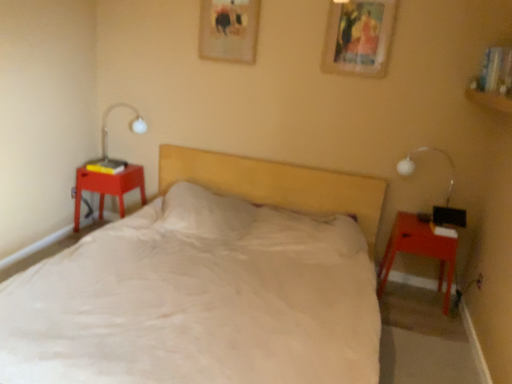
In order to face white soft bed at center, should I rotate leftwards or rightwards?

A 5.621 degree turn to the left will do.

The image size is (512, 384). What do you see at coordinates (108, 188) in the screenshot? I see `matte plastic nightstand at left, which ranks as the first nightstand in left-to-right order` at bounding box center [108, 188].

Measure the distance between white glossy table lamp at left and camera.

white glossy table lamp at left is 3.53 meters away from camera.

This screenshot has width=512, height=384. What are the coordinates of `white soft bed at center` in the screenshot? It's located at (208, 284).

Is matte red nightstand at right, which is counted as the 2th nightstand, starting from the back, taller or shorter than white glass bedside lamp at right?

matte red nightstand at right, which is counted as the 2th nightstand, starting from the back, is taller than white glass bedside lamp at right.

Measure the distance between matte red nightstand at right, marked as the 2th nightstand in a left-to-right arrangement, and white glass bedside lamp at right.

matte red nightstand at right, marked as the 2th nightstand in a left-to-right arrangement, is 46.20 centimeters from white glass bedside lamp at right.

Which object is positioned more to the right, matte red nightstand at right, which is counted as the 2th nightstand, starting from the back, or white glass bedside lamp at right?

white glass bedside lamp at right.

What's the angular difference between white glass bedside lamp at right and white glossy table lamp at left's facing directions?

The angular difference between white glass bedside lamp at right and white glossy table lamp at left is 0.52 degrees.

Does white glass bedside lamp at right have a lesser width compared to white glossy table lamp at left?

Indeed, white glass bedside lamp at right has a lesser width compared to white glossy table lamp at left.

Is point (403, 172) closer to camera compared to point (106, 111)?

Yes, point (403, 172) is in front of point (106, 111).

Is matte plastic nightstand at left, which is the second nightstand from front to back, not near matte red nightstand at right, arranged as the 1th nightstand when viewed from the front?

matte plastic nightstand at left, which is the second nightstand from front to back, is positioned a significant distance from matte red nightstand at right, arranged as the 1th nightstand when viewed from the front.

From a real-world perspective, is matte plastic nightstand at left, which ranks as the first nightstand in left-to-right order, under matte red nightstand at right, arranged as the 1th nightstand when viewed from the front?

No, from a real-world perspective, matte plastic nightstand at left, which ranks as the first nightstand in left-to-right order, is not under matte red nightstand at right, arranged as the 1th nightstand when viewed from the front.

Considering the relative sizes of matte plastic nightstand at left, which ranks as the first nightstand in left-to-right order, and matte red nightstand at right, which is counted as the 2th nightstand, starting from the back, in the image provided, is matte plastic nightstand at left, which ranks as the first nightstand in left-to-right order, taller than matte red nightstand at right, which is counted as the 2th nightstand, starting from the back,?

No.

Is point (143, 185) closer to viewer compared to point (410, 250)?

No, (143, 185) is further to viewer.

Based on their sizes in the image, would you say wooden picture frame at upper center, placed as the first picture frame when sorted from front to back, is bigger or smaller than wooden picture frame at upper center, the first picture frame when ordered from back to front?

Considering their sizes, wooden picture frame at upper center, placed as the first picture frame when sorted from front to back, takes up more space than wooden picture frame at upper center, the first picture frame when ordered from back to front.

Who is shorter, wooden picture frame at upper center, placed as the second picture frame when sorted from left to right, or wooden picture frame at upper center, which is the first picture frame in left-to-right order?

wooden picture frame at upper center, which is the first picture frame in left-to-right order.

How many degrees apart are the facing directions of wooden picture frame at upper center, placed as the second picture frame when sorted from left to right, and wooden picture frame at upper center, which is the first picture frame in left-to-right order?

The facing directions of wooden picture frame at upper center, placed as the second picture frame when sorted from left to right, and wooden picture frame at upper center, which is the first picture frame in left-to-right order, are 0.00937 degrees apart.

Looking at this image, choose the correct answer: Is wooden picture frame at upper center, the first picture frame when ordered from right to left, inside wooden picture frame at upper center, which is the first picture frame in left-to-right order, or outside it?

wooden picture frame at upper center, the first picture frame when ordered from right to left, is not enclosed by wooden picture frame at upper center, which is the first picture frame in left-to-right order.

From the image's perspective, who appears lower, wooden picture frame at upper center, which is the first picture frame in left-to-right order, or matte red nightstand at right, the first nightstand when ordered from right to left?

matte red nightstand at right, the first nightstand when ordered from right to left.

In terms of width, does wooden picture frame at upper center, which is the first picture frame in left-to-right order, look wider or thinner when compared to matte red nightstand at right, arranged as the 1th nightstand when viewed from the front?

wooden picture frame at upper center, which is the first picture frame in left-to-right order, is thinner than matte red nightstand at right, arranged as the 1th nightstand when viewed from the front.

Can we say wooden picture frame at upper center, the first picture frame when ordered from back to front, lies outside matte red nightstand at right, arranged as the 1th nightstand when viewed from the front?

Yes.

How distant is wooden picture frame at upper center, arranged as the second picture frame when viewed from the right, from matte red nightstand at right, arranged as the 1th nightstand when viewed from the front?

wooden picture frame at upper center, arranged as the second picture frame when viewed from the right, is 5.92 feet away from matte red nightstand at right, arranged as the 1th nightstand when viewed from the front.

From a real-world perspective, is matte plastic nightstand at left, which is the second nightstand from front to back, physically below wooden picture frame at upper center, arranged as the 2th picture frame when viewed from the back?

Indeed, from a real-world perspective, matte plastic nightstand at left, which is the second nightstand from front to back, is positioned beneath wooden picture frame at upper center, arranged as the 2th picture frame when viewed from the back.

Between matte plastic nightstand at left, the 2th nightstand when ordered from right to left, and wooden picture frame at upper center, arranged as the 2th picture frame when viewed from the back, which one is positioned in front?

wooden picture frame at upper center, arranged as the 2th picture frame when viewed from the back, is in front.

From the image's perspective, which is above, matte plastic nightstand at left, which ranks as the first nightstand in left-to-right order, or wooden picture frame at upper center, arranged as the 2th picture frame when viewed from the back?

From the image's view, wooden picture frame at upper center, arranged as the 2th picture frame when viewed from the back, is above.

Considering the sizes of objects matte plastic nightstand at left, the 2th nightstand when ordered from right to left, and wooden picture frame at upper center, placed as the second picture frame when sorted from left to right, in the image provided, who is smaller, matte plastic nightstand at left, the 2th nightstand when ordered from right to left, or wooden picture frame at upper center, placed as the second picture frame when sorted from left to right,?

wooden picture frame at upper center, placed as the second picture frame when sorted from left to right.

Is wooden picture frame at upper center, the first picture frame when ordered from back to front, positioned beyond the bounds of wooden picture frame at upper center, the first picture frame when ordered from right to left?

Yes, wooden picture frame at upper center, the first picture frame when ordered from back to front, is outside of wooden picture frame at upper center, the first picture frame when ordered from right to left.

Between point (222, 21) and point (330, 52), which one is positioned in front?

The point (330, 52) is closer to the camera.

In the image, there is a wooden picture frame at upper center, placed as the 2th picture frame when sorted from front to back. Where is `picture frame below it (from the image's perspective)`? picture frame below it (from the image's perspective) is located at coordinates (359, 37).

Who is bigger, wooden picture frame at upper center, the first picture frame when ordered from back to front, or wooden picture frame at upper center, placed as the second picture frame when sorted from left to right?

Bigger between the two is wooden picture frame at upper center, placed as the second picture frame when sorted from left to right.

At what (x,y) coordinates should I click in order to perform the action: click on nightstand in front of the white glass bedside lamp at right. Please return your answer as a coordinate pair (x, y). Image resolution: width=512 pixels, height=384 pixels. Looking at the image, I should click on (419, 251).

In order to click on bedside lamp located below the white glossy table lamp at left (from the image's perspective) in this screenshot , I will do click(x=415, y=167).

Looking at the image, which one is located further to wooden picture frame at upper center, the first picture frame when ordered from right to left, white glass bedside lamp at right or matte plastic nightstand at left, which ranks as the first nightstand in left-to-right order?

Based on the image, matte plastic nightstand at left, which ranks as the first nightstand in left-to-right order, appears to be further to wooden picture frame at upper center, the first picture frame when ordered from right to left.

From the image, which object appears to be farther from white glass bedside lamp at right, white soft bed at center or wooden picture frame at upper center, which is the first picture frame in left-to-right order?

wooden picture frame at upper center, which is the first picture frame in left-to-right order.

Considering their positions, is wooden picture frame at upper center, which is the first picture frame in left-to-right order, positioned closer to wooden picture frame at upper center, placed as the first picture frame when sorted from front to back, than white glass bedside lamp at right?

wooden picture frame at upper center, which is the first picture frame in left-to-right order, is closer to wooden picture frame at upper center, placed as the first picture frame when sorted from front to back.

When comparing their distances from white glass bedside lamp at right, does wooden picture frame at upper center, the first picture frame when ordered from right to left, or white glossy table lamp at left seem closer?

wooden picture frame at upper center, the first picture frame when ordered from right to left, is closer to white glass bedside lamp at right.

When comparing their distances from wooden picture frame at upper center, the first picture frame when ordered from back to front, does white glossy table lamp at left or white soft bed at center seem further?

white soft bed at center.

Which object lies further to the anchor point white soft bed at center, matte plastic nightstand at left, which ranks as the first nightstand in left-to-right order, or wooden picture frame at upper center, the first picture frame when ordered from back to front?

wooden picture frame at upper center, the first picture frame when ordered from back to front, lies further to white soft bed at center than the other object.

Estimate the real-world distances between objects in this image. Which object is further from white soft bed at center, matte plastic nightstand at left, marked as the 1th nightstand in a back-to-front arrangement, or matte red nightstand at right, which is counted as the 2th nightstand, starting from the back?

matte plastic nightstand at left, marked as the 1th nightstand in a back-to-front arrangement.

Considering their positions, is matte plastic nightstand at left, marked as the 1th nightstand in a back-to-front arrangement, positioned further to matte red nightstand at right, marked as the 2th nightstand in a left-to-right arrangement, than wooden picture frame at upper center, the first picture frame when ordered from right to left?

Among the two, matte plastic nightstand at left, marked as the 1th nightstand in a back-to-front arrangement, is located further to matte red nightstand at right, marked as the 2th nightstand in a left-to-right arrangement.

Locate an element on the screen. picture frame between wooden picture frame at upper center, the first picture frame when ordered from back to front, and white glass bedside lamp at right from left to right is located at coordinates (359, 37).

The width and height of the screenshot is (512, 384). Find the location of `nightstand between white glossy table lamp at left and white glass bedside lamp at right`. nightstand between white glossy table lamp at left and white glass bedside lamp at right is located at coordinates (419, 251).

At what (x,y) coordinates should I click in order to perform the action: click on table lamp between wooden picture frame at upper center, which is the first picture frame in left-to-right order, and matte plastic nightstand at left, which is the second nightstand from front to back, in the vertical direction. Please return your answer as a coordinate pair (x, y). The width and height of the screenshot is (512, 384). Looking at the image, I should click on (130, 126).

At what (x,y) coordinates should I click in order to perform the action: click on table lamp situated between matte plastic nightstand at left, marked as the 1th nightstand in a back-to-front arrangement, and wooden picture frame at upper center, arranged as the 2th picture frame when viewed from the back, from left to right. Please return your answer as a coordinate pair (x, y). Image resolution: width=512 pixels, height=384 pixels. Looking at the image, I should click on (130, 126).